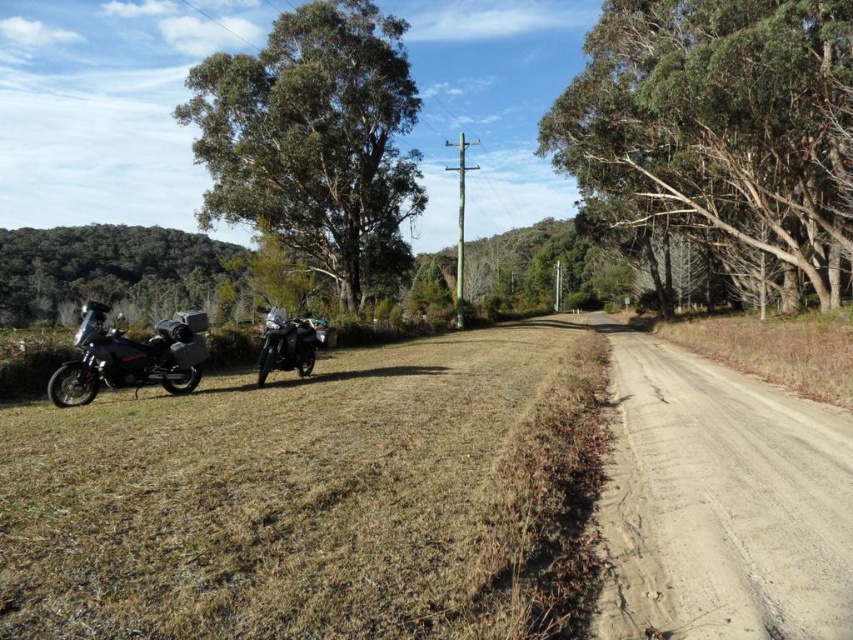
You are a hiker who wants to take a photo of the green rough bark tree at upper right from the point marked at coordinates point (717, 124). Can you stand at that point and take the photo without moving?

Yes, because the point (717, 124) is where the green rough bark tree at upper right is located, so you can stand there to take the photo.

You are a hiker trying to locate the green rough bark tree at upper right. You see the dusty gravel road at right ahead of you. Which direction should you walk to find the tree?

The green rough bark tree at upper right is to the right of the dusty gravel road at right, so you should walk to the right of the road to find the tree.

You are planning to take a photo of the green rough bark tree at upper right and the dusty gravel road at right. To ensure both are fully visible in the frame, which object should you position closer to the camera?

The green rough bark tree at upper right might be wider than the dusty gravel road at right, so you should position the green rough bark tree at upper right closer to the camera to ensure both fit in the frame.